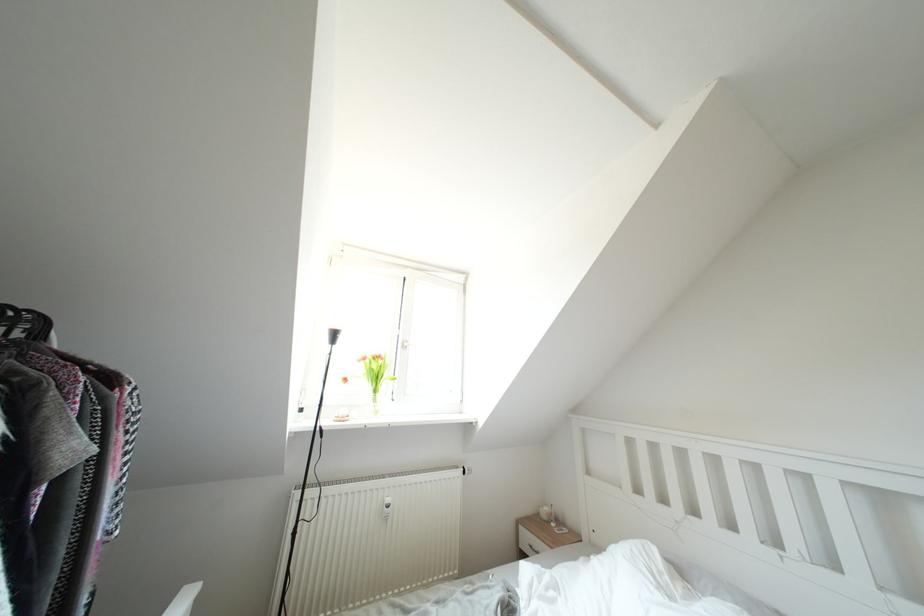
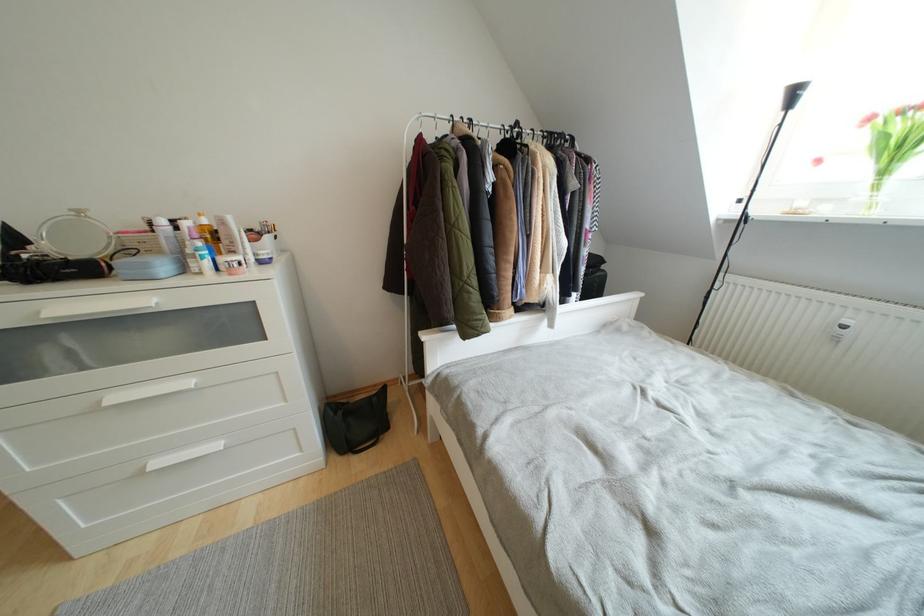
The images are taken continuously from a first-person perspective. In which direction is your viewpoint rotating?

The camera's rotation is toward left-down.